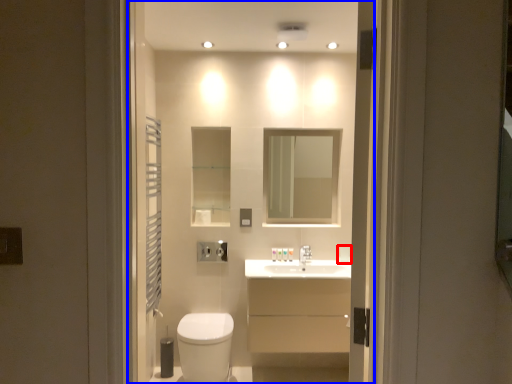
Question: Which object is further to the camera taking this photo, toilet paper (highlighted by a red box) or residence (highlighted by a blue box)?

Choices:
 (A) toilet paper
 (B) residence

Answer: (A)